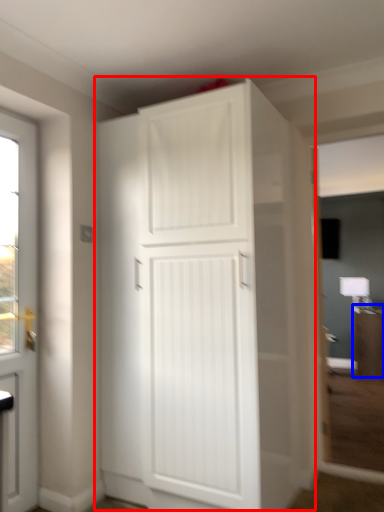
Question: Which object is further to the camera taking this photo, cupboard (highlighted by a red box) or cabinetry (highlighted by a blue box)?

Choices:
 (A) cupboard
 (B) cabinetry

Answer: (B)